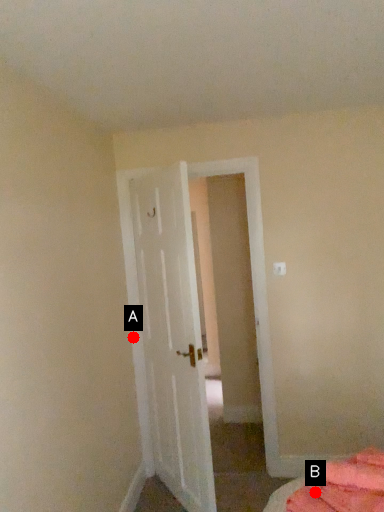
Question: Two points are circled on the image, labeled by A and B beside each circle. Which of the following is the closest to the observer?

Choices:
 (A) A is closer
 (B) B is closer

Answer: (B)